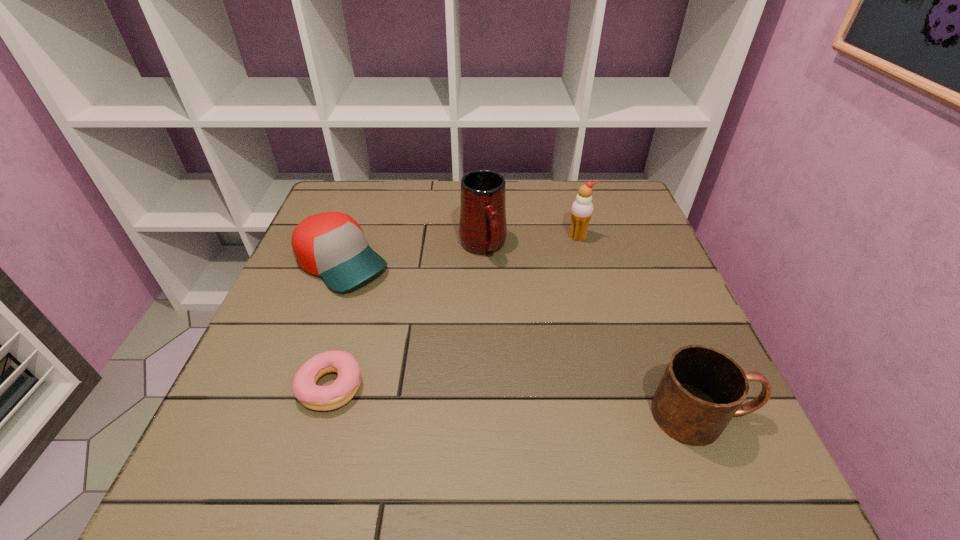
The width and height of the screenshot is (960, 540). Find the location of `the shortest object`. the shortest object is located at coordinates (321, 398).

Where is `the nearer mug`? This screenshot has height=540, width=960. the nearer mug is located at coordinates (702, 388).

The image size is (960, 540). Find the location of `the right mug`. the right mug is located at coordinates 702,388.

Where is `baseball cap`? This screenshot has height=540, width=960. baseball cap is located at coordinates (332, 245).

I want to click on the second object from right to left, so click(x=582, y=208).

The image size is (960, 540). I want to click on the third object from left to right, so click(x=482, y=226).

Where is `the taller mug`? Image resolution: width=960 pixels, height=540 pixels. the taller mug is located at coordinates (482, 226).

Locate an element on the screen. blank area located 0.100m on the left of the doughnut is located at coordinates (243, 386).

Where is `blank space located 0.200m at the brim of the baseball cap`? blank space located 0.200m at the brim of the baseball cap is located at coordinates (431, 332).

Identify the location of vacant space situated at the brim of the baseball cap. (412, 318).